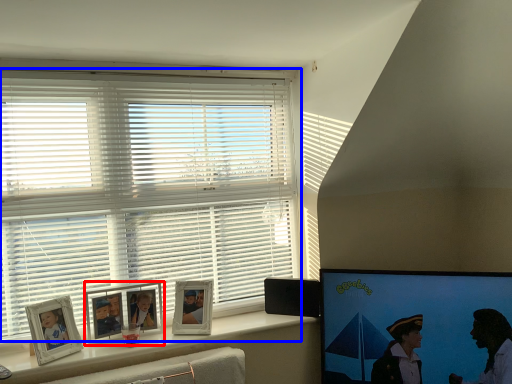
Question: Which object is closer to the camera taking this photo, picture frame (highlighted by a red box) or window blind (highlighted by a blue box)?

Choices:
 (A) picture frame
 (B) window blind

Answer: (B)